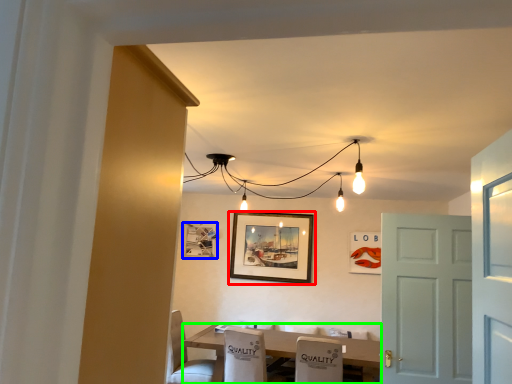
Question: Which is nearer to the picture frame (highlighted by a red box)? picture frame (highlighted by a blue box) or table (highlighted by a green box).

Choices:
 (A) picture frame
 (B) table

Answer: (A)